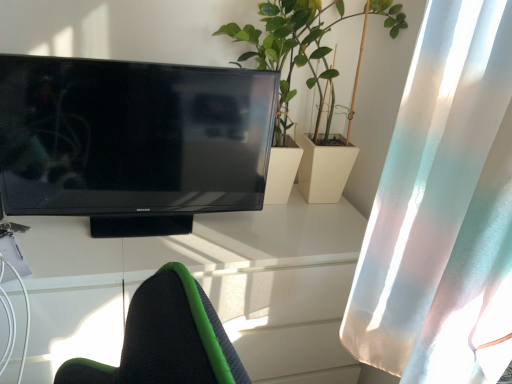
Question: Looking at their shapes, would you say white glossy desk at center is wider or thinner than matte black television at left?

Choices:
 (A) thin
 (B) wide

Answer: (B)

Question: From the image's perspective, is white glossy desk at center above or below matte black television at left?

Choices:
 (A) above
 (B) below

Answer: (B)

Question: Estimate the real-world distances between objects in this image. Which object is farther from the white glossy desk at center?

Choices:
 (A) green leafy plant at center
 (B) matte black television at left
 (C) translucent white curtain at right

Answer: (A)

Question: Which is nearer to the white glossy desk at center?

Choices:
 (A) translucent white curtain at right
 (B) matte black television at left
 (C) green leafy plant at center

Answer: (B)